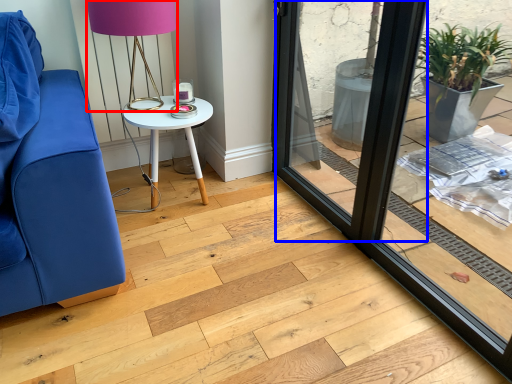
Question: Among these objects, which one is nearest to the camera, table lamp (highlighted by a red box) or screen door (highlighted by a blue box)?

Choices:
 (A) table lamp
 (B) screen door

Answer: (B)